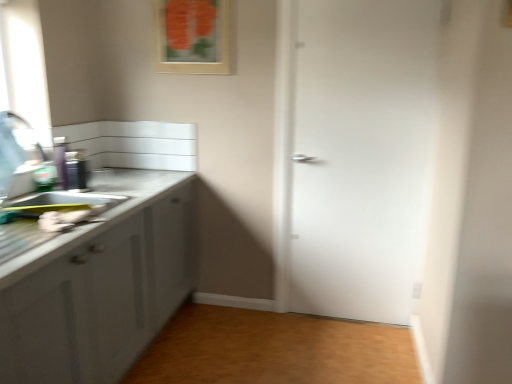
Image resolution: width=512 pixels, height=384 pixels. What do you see at coordinates (274, 350) in the screenshot?
I see `wooden floor at lower center` at bounding box center [274, 350].

In order to click on wooden picture frame at upper center in this screenshot , I will do `click(194, 36)`.

Locate an element on the screen. The image size is (512, 384). wooden floor at lower center is located at coordinates (274, 350).

From the image's perspective, relative to wooden floor at lower center, is white matte door at center above or below?

white matte door at center is above wooden floor at lower center.

Which is behind, point (370, 205) or point (347, 323)?

Positioned behind is point (347, 323).

At what (x,y) coordinates should I click in order to perform the action: click on plain that is in front of the white matte door at center. Please return your answer as a coordinate pair (x, y). Looking at the image, I should click on (274, 350).

Considering the sizes of white matte door at center and wooden floor at lower center in the image, is white matte door at center taller or shorter than wooden floor at lower center?

Clearly, white matte door at center is taller compared to wooden floor at lower center.

At what (x,y) coordinates should I click in order to perform the action: click on appliance located above the white matte door at center (from the image's perspective). Please return your answer as a coordinate pair (x, y). Looking at the image, I should click on (76, 170).

Could you tell me if metallic canister at left is facing white matte door at center?

No.

Is metallic canister at left directly adjacent to white matte door at center?

No, metallic canister at left is not next to white matte door at center.

In the scene shown: How different are the orientations of metallic canister at left and white matte door at center in degrees?

They differ by 86.6 degrees in their facing directions.

Does point (13, 218) lie behind point (374, 85)?

No.

Considering the sizes of objects matte white sink at left and white matte door at center in the image provided, who is wider, matte white sink at left or white matte door at center?

matte white sink at left.

Looking at this image, between matte white sink at left and white matte door at center, which one has smaller size?

matte white sink at left.

From a real-world perspective, is matte white sink at left on white matte door at center?

No, from a real-world perspective, matte white sink at left is not above white matte door at center.

Consider the image. Is metallic canister at left situated inside wooden floor at lower center or outside?

metallic canister at left lies outside wooden floor at lower center.

Is metallic canister at left turned away from wooden floor at lower center?

That's not correct — metallic canister at left is not looking away from wooden floor at lower center.

How different are the orientations of metallic canister at left and wooden floor at lower center in degrees?

178 degrees.

Is wooden picture frame at upper center inside or outside of brushed metal faucet at left?

wooden picture frame at upper center is not enclosed by brushed metal faucet at left.

From the image's perspective, which is below, wooden picture frame at upper center or brushed metal faucet at left?

brushed metal faucet at left.

At what (x,y) coordinates should I click in order to perform the action: click on picture frame above the brushed metal faucet at left (from the image's perspective). Please return your answer as a coordinate pair (x, y). Looking at the image, I should click on point(194,36).

Is wooden picture frame at upper center in front of or behind brushed metal faucet at left in the image?

wooden picture frame at upper center is positioned farther from the viewer than brushed metal faucet at left.

Is matte white sink at left wider or thinner than metallic canister at left?

In the image, matte white sink at left appears to be wider than metallic canister at left.

What's the angular difference between matte white sink at left and metallic canister at left's facing directions?

3.17 degrees separate the facing orientations of matte white sink at left and metallic canister at left.

In the image, is matte white sink at left positioned in front of or behind metallic canister at left?

matte white sink at left is positioned closer to the viewer than metallic canister at left.

From the image's perspective, is matte white sink at left beneath metallic canister at left?

Indeed, from the image's perspective, matte white sink at left is shown beneath metallic canister at left.

Is brushed metal faucet at left wider than wooden floor at lower center?

No, brushed metal faucet at left is not wider than wooden floor at lower center.

From the image's perspective, which object appears higher, brushed metal faucet at left or wooden floor at lower center?

brushed metal faucet at left, from the image's perspective.

Is brushed metal faucet at left positioned far away from wooden floor at lower center?

brushed metal faucet at left is far away from wooden floor at lower center.

Does brushed metal faucet at left come behind wooden floor at lower center?

No, it is in front of wooden floor at lower center.

Find the location of `door located behind the wooden floor at lower center`. door located behind the wooden floor at lower center is located at coordinates (361, 155).

The width and height of the screenshot is (512, 384). I want to click on door below the metallic canister at left (from a real-world perspective), so click(x=361, y=155).

Estimate the real-world distances between objects in this image. Which object is further from metallic canister at left, wooden picture frame at upper center or brushed metal faucet at left?

Among the two, wooden picture frame at upper center is located further to metallic canister at left.

When comparing their distances from wooden picture frame at upper center, does brushed metal faucet at left or white matte door at center seem closer?

Among the two, white matte door at center is located nearer to wooden picture frame at upper center.

Considering their positions, is metallic canister at left positioned closer to white matte door at center than wooden floor at lower center?

The object closer to white matte door at center is wooden floor at lower center.

Based on their spatial positions, is wooden picture frame at upper center or matte white sink at left closer to metallic canister at left?

matte white sink at left is closer to metallic canister at left.

From the picture: From the image, which object appears to be farther from wooden floor at lower center, white matte door at center or wooden picture frame at upper center?

wooden picture frame at upper center is further to wooden floor at lower center.

When comparing their distances from metallic canister at left, does wooden floor at lower center or white matte door at center seem further?

Among the two, white matte door at center is located further to metallic canister at left.

Considering their positions, is brushed metal faucet at left positioned closer to metallic canister at left than white matte door at center?

brushed metal faucet at left lies closer to metallic canister at left than the other object.

Considering their positions, is metallic canister at left positioned further to brushed metal faucet at left than white matte door at center?

white matte door at center is positioned further to the anchor brushed metal faucet at left.

The height and width of the screenshot is (384, 512). In order to click on faucet that lies between wooden picture frame at upper center and wooden floor at lower center from top to bottom in this screenshot , I will do `click(25, 137)`.

This screenshot has width=512, height=384. What are the coordinates of `sink between brushed metal faucet at left and metallic canister at left along the z-axis` in the screenshot? It's located at (56, 204).

Where is `appliance between brushed metal faucet at left and white matte door at center from left to right`? The image size is (512, 384). appliance between brushed metal faucet at left and white matte door at center from left to right is located at coordinates (76, 170).

Find the location of a particular element. The image size is (512, 384). picture frame between metallic canister at left and white matte door at center is located at coordinates (194, 36).